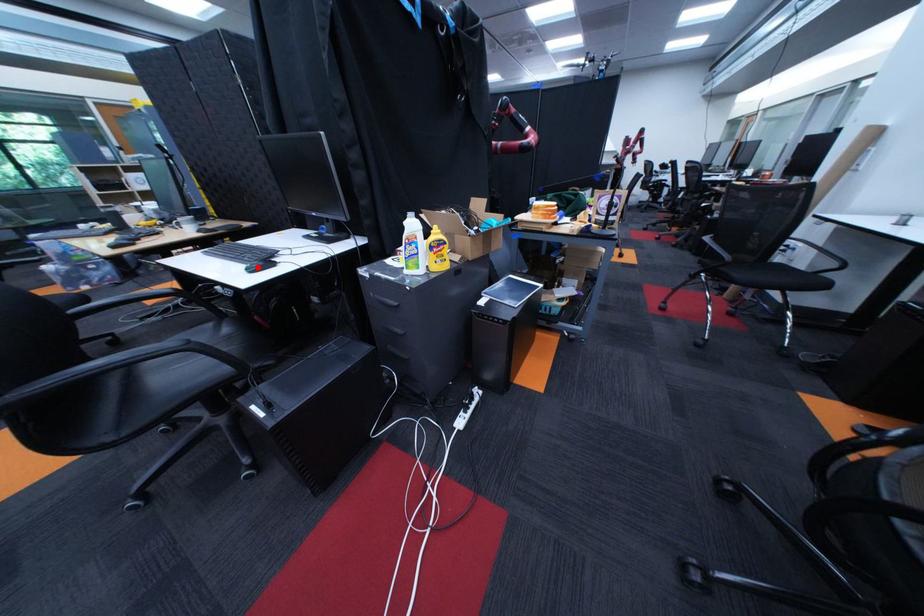
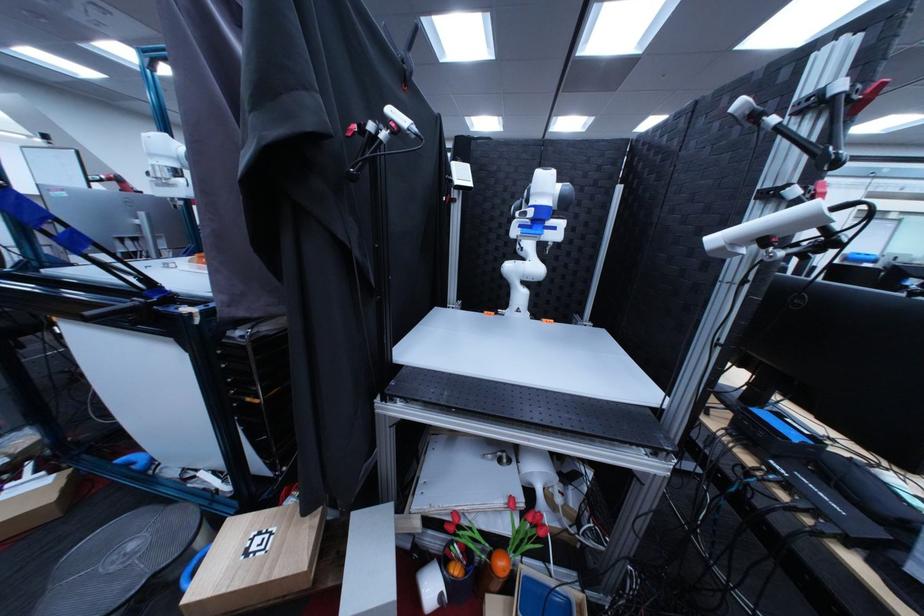
Question: I am providing you with two images of the same scene from different viewpoints. A red point is marked on the first image. At the location where the point appears in image 1, is it still visible in image 2?

Choices:
 (A) Yes
 (B) No

Answer: (B)